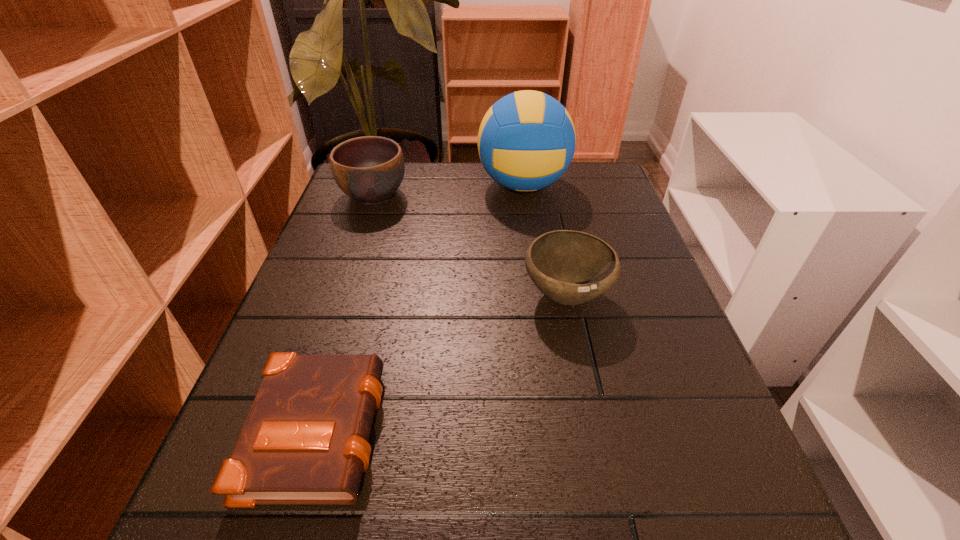
At what (x,y) coordinates should I click in order to perform the action: click on vacant space located on the spine side of the Bible. Please return your answer as a coordinate pair (x, y). Looking at the image, I should click on [469, 427].

Where is `volleyball that is at the far edge`? The width and height of the screenshot is (960, 540). volleyball that is at the far edge is located at coordinates (526, 141).

At what (x,y) coordinates should I click in order to perform the action: click on bowl that is at the far edge. Please return your answer as a coordinate pair (x, y). Image resolution: width=960 pixels, height=540 pixels. Looking at the image, I should click on [370, 169].

I want to click on object positioned at the near edge, so click(305, 440).

Identify the location of bowl present at the left edge. The height and width of the screenshot is (540, 960). (370, 169).

Where is `Bible at the left edge`? Image resolution: width=960 pixels, height=540 pixels. Bible at the left edge is located at coordinates (305, 440).

Locate an element on the screen. This screenshot has width=960, height=540. volleyball at the right edge is located at coordinates (526, 141).

In order to click on bowl that is at the right edge in this screenshot , I will do `click(570, 267)`.

Find the location of a particular element. The height and width of the screenshot is (540, 960). object present at the far left corner is located at coordinates (370, 169).

The height and width of the screenshot is (540, 960). Identify the location of object situated at the near left corner. (305, 440).